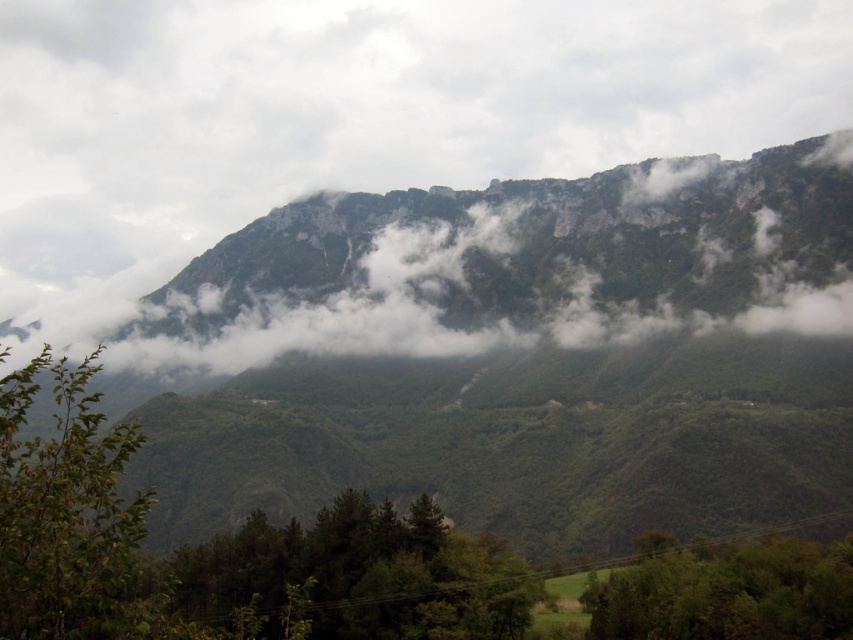
Who is more forward, (138, 124) or (4, 589)?

Positioned in front is point (4, 589).

Between white fluffy cloud at upper center and green leafy tree at lower left, which one is positioned higher?

white fluffy cloud at upper center

Is point (263, 104) farther from camera compared to point (108, 620)?

Yes, it is behind point (108, 620).

Where is `white fluffy cloud at upper center`? Image resolution: width=853 pixels, height=640 pixels. white fluffy cloud at upper center is located at coordinates (357, 113).

Can you confirm if green leafy tree at lower center is positioned below green leafy tree at lower left?

Yes.

Is green leafy tree at lower center above green leafy tree at lower left?

Incorrect, green leafy tree at lower center is not positioned above green leafy tree at lower left.

The image size is (853, 640). In order to click on green leafy tree at lower center in this screenshot , I will do `click(358, 577)`.

Can you confirm if green leafy tree at lower left is taller than green leafy tree at lower right?

Yes.

At what (x,y) coordinates should I click in order to perform the action: click on green leafy tree at lower left. Please return your answer as a coordinate pair (x, y). The image size is (853, 640). Looking at the image, I should click on (68, 516).

At what (x,y) coordinates should I click in order to perform the action: click on green leafy tree at lower left. Please return your answer as a coordinate pair (x, y). The height and width of the screenshot is (640, 853). Looking at the image, I should click on (68, 516).